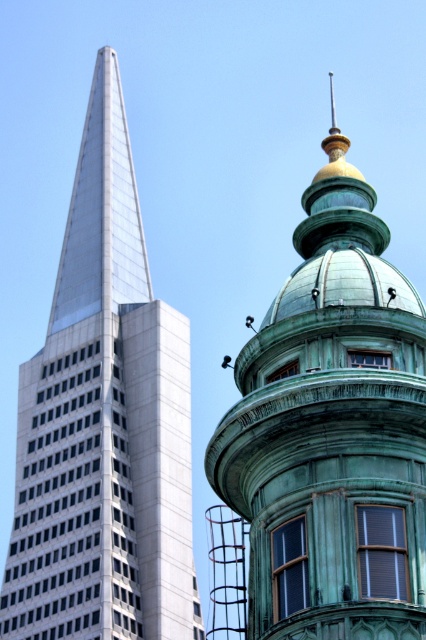
You are an architect evaluating the two buildings in the image. Which structure has a lower height? Please consider the green patina dome at upper center and the metallic glass skyscraper at left in your analysis.

The green patina dome at upper center has a lesser height compared to the metallic glass skyscraper at left, so the green patina dome at upper center is the lower one.

You are an architect analyzing the spatial relationship between the green patina dome at upper center and the metallic glass skyscraper at left. Which structure is located above the other?

The green patina dome at upper center is positioned over the metallic glass skyscraper at left, meaning it is above the skyscraper.

You are an architect analyzing the spatial relationship between the two buildings in the image. Which of the two structures, the green patina dome at upper center or the metallic glass skyscraper at left, is positioned to the east if the sun is setting in the west?

The green patina dome at upper center is to the right of the metallic glass skyscraper at left. Since the sun is setting in the west, the structure positioned to the east would be the one receiving more sunlight. The metallic glass skyscraper at left is on the east side because it is to the left of the green patina dome at upper center, which is on the west side. Therefore, the metallic glass skyscraper at left is positioned to the east.